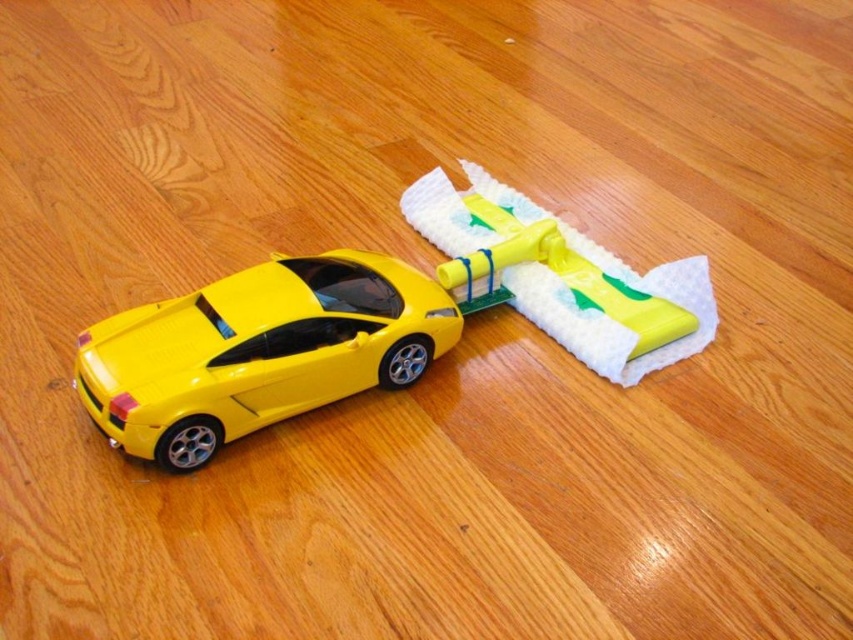
Who is more forward, [281,365] or [657,348]?

Point [281,365]

Who is lower down, yellow glossy car at center or yellow matte/matte plastic toy car at upper center?

yellow glossy car at center

Find the location of a particular element. The width and height of the screenshot is (853, 640). yellow glossy car at center is located at coordinates (258, 349).

Find the location of a particular element. The width and height of the screenshot is (853, 640). yellow glossy car at center is located at coordinates (258, 349).

Can you confirm if yellow matte car at center is thinner than yellow glossy car at center?

No.

Which is more to the left, yellow matte car at center or yellow glossy car at center?

Positioned to the left is yellow glossy car at center.

Where is `yellow matte car at center`? The image size is (853, 640). yellow matte car at center is located at coordinates (376, 321).

How far apart are yellow matte car at center and yellow matte/matte plastic toy car at upper center?

They are 4.36 inches apart.

Is point (630, 308) in front of point (659, 282)?

Yes, it is.

Find the location of a particular element. yellow matte car at center is located at coordinates (376, 321).

I want to click on yellow matte car at center, so click(x=376, y=321).